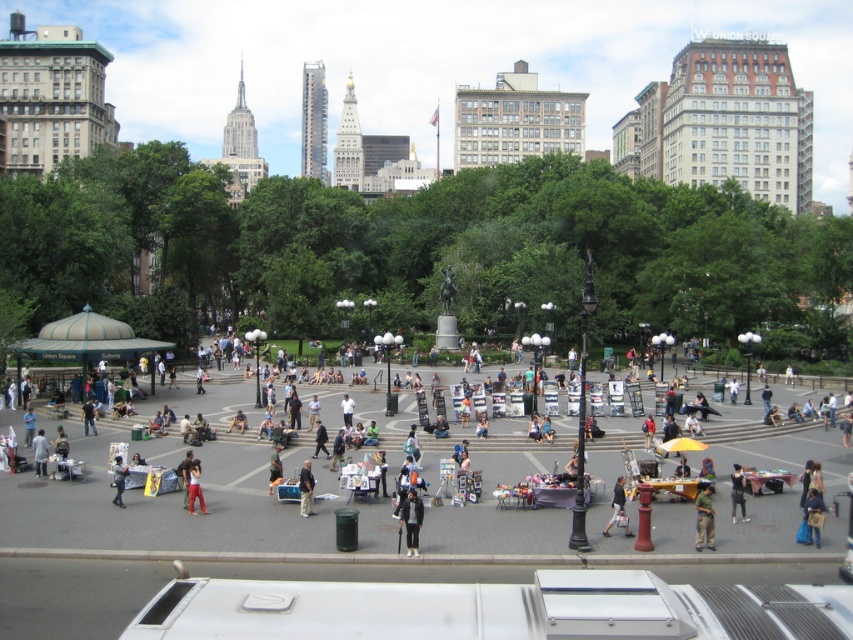
You are a photographer standing in the park and want to take a photo of both the dark blue jeans at center and the dark blue jeans at lower left. Which of the two dark blue jeans should you focus on first to ensure both are in the frame?

You should focus on the dark blue jeans at lower left first because the dark blue jeans at center is in front of it, so adjusting the framing to include both would require ensuring the background jeans are still visible without being blocked.

You are a photographer trying to capture a candid shot of the green matte shirt at lower right and the dark blue jeans at lower left in the park scene. Since you want to ensure both subjects are in focus, you need to know which one is wider. Can you tell me which is wider?

The green matte shirt at lower right is wider than the dark blue jeans at lower left, so you should adjust your camera settings to accommodate the wider subject.